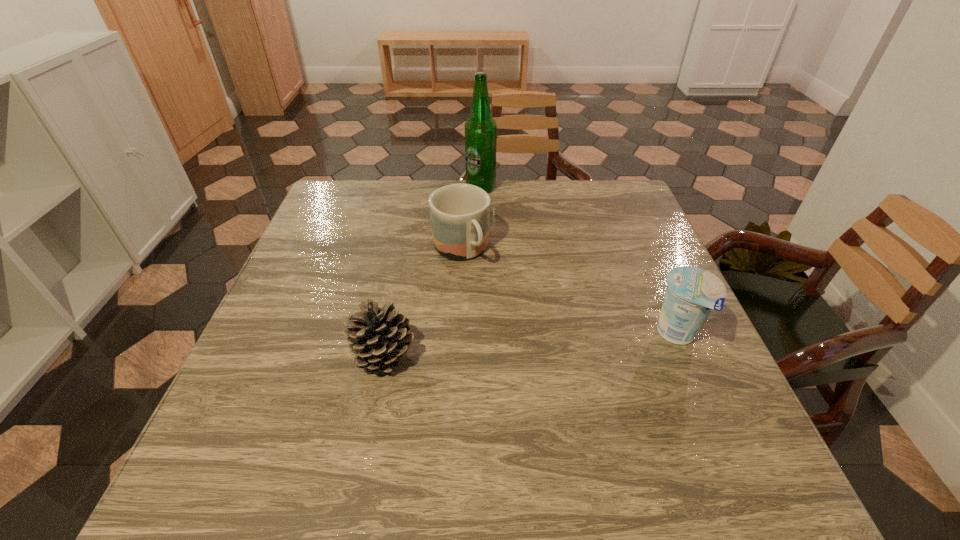
Where is `vacant space located 0.250m on the label of the tallest object`? vacant space located 0.250m on the label of the tallest object is located at coordinates 484,246.

Where is `free location located on the label of the tallest object`? This screenshot has width=960, height=540. free location located on the label of the tallest object is located at coordinates [482, 208].

The width and height of the screenshot is (960, 540). In order to click on vacant space positioned 0.140m on the label of the tallest object in this screenshot , I will do `click(483, 222)`.

At what (x,y) coordinates should I click in order to perform the action: click on object present at the far edge. Please return your answer as a coordinate pair (x, y). Looking at the image, I should click on (480, 128).

Find the location of `object situated at the right edge`. object situated at the right edge is located at coordinates (692, 293).

Identify the location of vacant space at the far edge of the desktop. The width and height of the screenshot is (960, 540). (574, 179).

I want to click on vacant area at the near edge, so click(517, 403).

The image size is (960, 540). In order to click on vacant space at the left edge of the desktop in this screenshot , I will do `click(304, 254)`.

Find the location of a particular element. This screenshot has height=540, width=960. vacant space at the right edge of the desktop is located at coordinates (601, 250).

At what (x,y) coordinates should I click in order to perform the action: click on free space at the far left corner of the desktop. Please return your answer as a coordinate pair (x, y). This screenshot has width=960, height=540. Looking at the image, I should click on (340, 215).